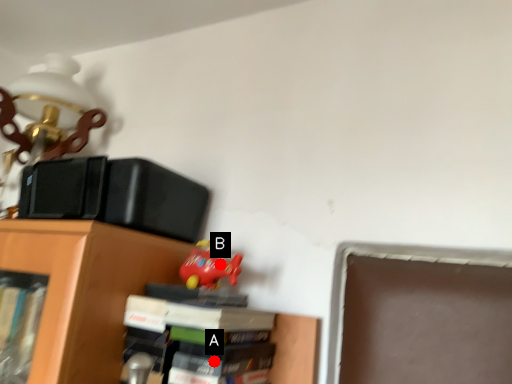
Question: Two points are circled on the image, labeled by A and B beside each circle. Which point is farther to the camera?

Choices:
 (A) A is further
 (B) B is further

Answer: (B)